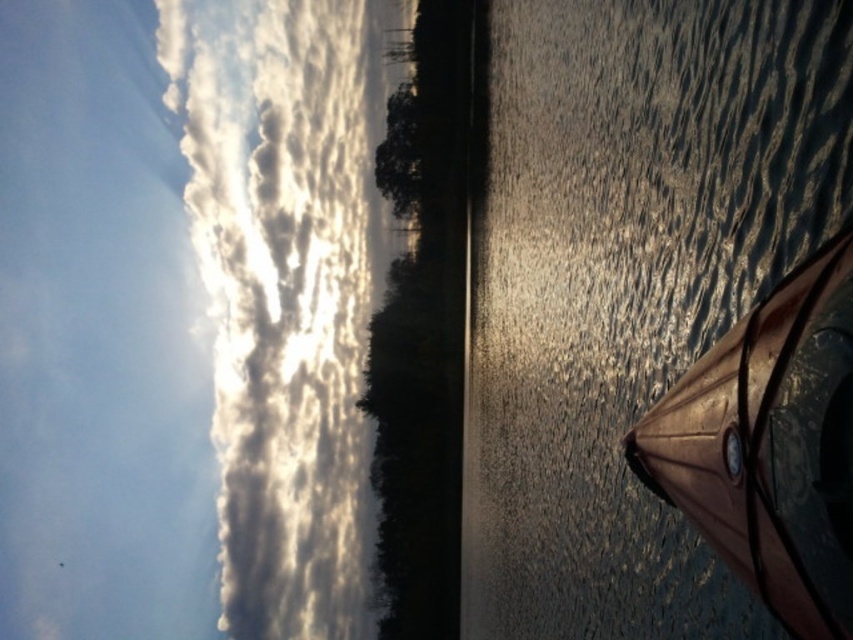
You are standing at the center of the image and want to walk to the glistening water at lower right. Which direction should you face to move directly towards it?

You should face towards the lower right direction to move directly towards the glistening water at lower right.

You are standing at the lakeside and want to walk towards the two points marked in the image. Which point, point (480, 106) or point (213, 388), will you reach first?

You will reach point (480, 106) first because it is closer to you than point (213, 388).